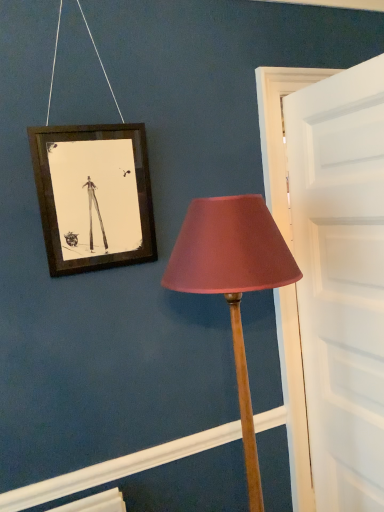
Question: Is matte pink fabric lampshade at center-right taller or shorter than white matte door at right?

Choices:
 (A) tall
 (B) short

Answer: (B)

Question: From a real-world perspective, is matte pink fabric lampshade at center-right positioned above or below white matte door at right?

Choices:
 (A) below
 (B) above

Answer: (A)

Question: Is matte pink fabric lampshade at center-right inside the boundaries of white matte door at right, or outside?

Choices:
 (A) inside
 (B) outside

Answer: (B)

Question: From a real-world perspective, relative to matte pink fabric lampshade at center-right, is white matte door at right vertically above or below?

Choices:
 (A) above
 (B) below

Answer: (A)

Question: Based on their sizes in the image, would you say white matte door at right is bigger or smaller than matte pink fabric lampshade at center-right?

Choices:
 (A) big
 (B) small

Answer: (B)

Question: Do you think white matte door at right is within matte pink fabric lampshade at center-right, or outside of it?

Choices:
 (A) outside
 (B) inside

Answer: (A)

Question: Considering the positions of point (379, 94) and point (264, 220), is point (379, 94) closer or farther from the camera than point (264, 220)?

Choices:
 (A) closer
 (B) farther

Answer: (B)